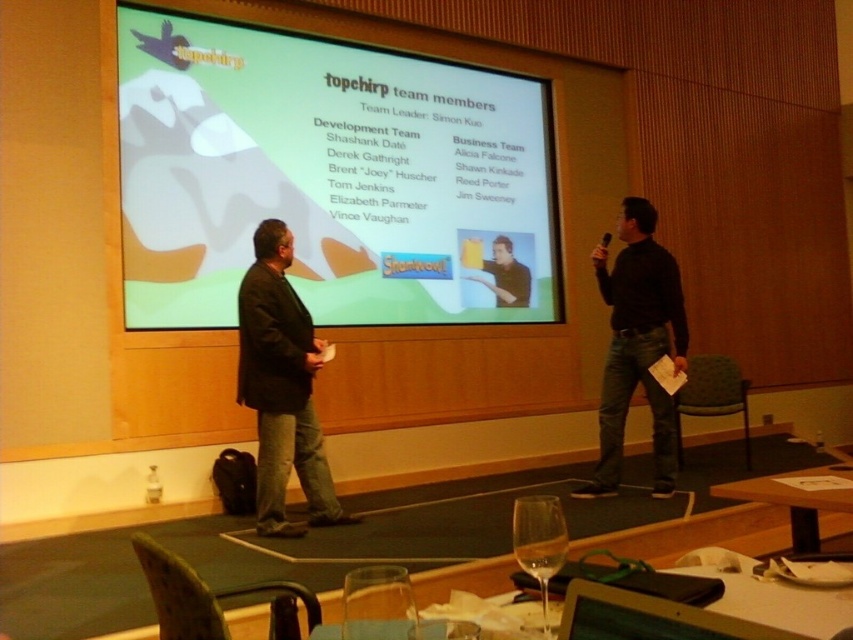
You are attending a presentation and want to locate the speaker. The speaker is standing next to the white matte projection screen at upper center. Where should you look relative to the black matte sweater at center?

The speaker is standing to the left of the black matte sweater at center because the white matte projection screen at upper center is to the left of the black matte sweater at center, and the speaker is next to the screen.

From the picture: You are standing in the conference room and want to locate the white matte projection screen at upper center. According to the coordinates provided, where exactly should you look?

The white matte projection screen at upper center is located at point 0.275 on the x axis and 0.383 on the y axis.